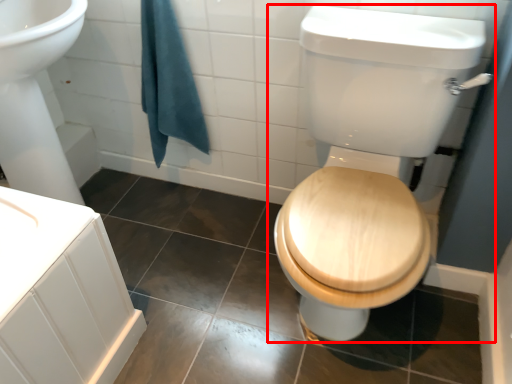
Question: Where is toilet (annotated by the red box) located in relation to bath towel in the image?

Choices:
 (A) right
 (B) left

Answer: (A)